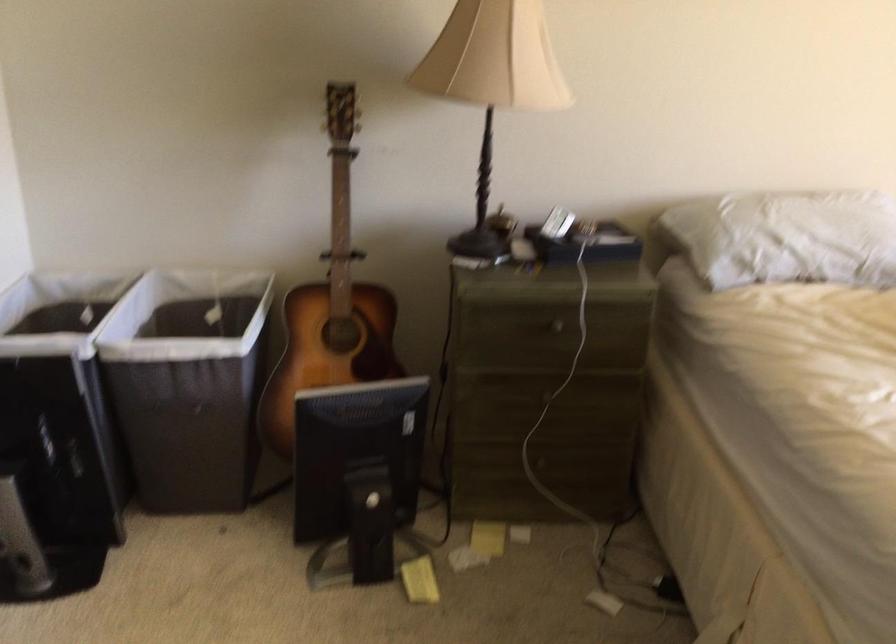
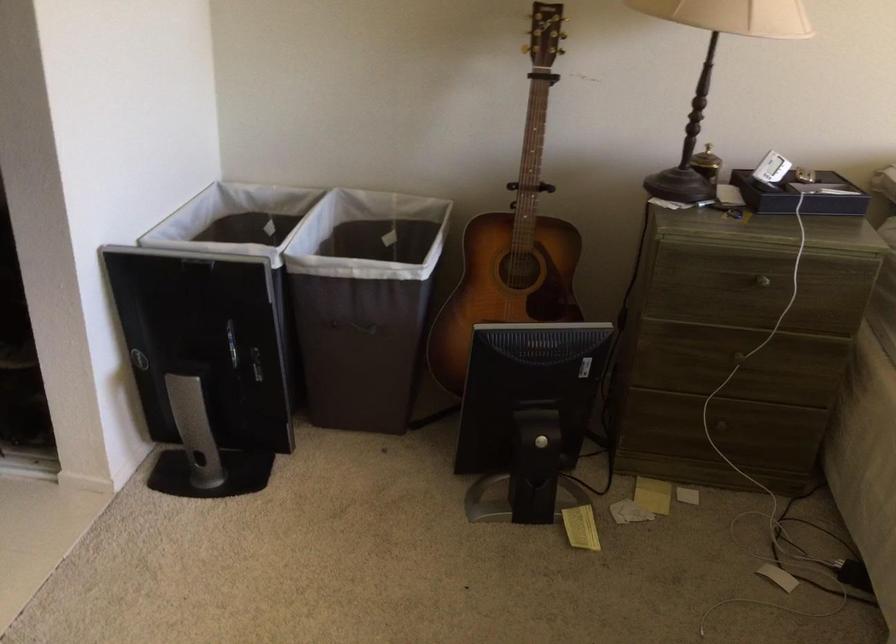
Question: The images are taken continuously from a first-person perspective. In which direction is your viewpoint rotating?

Choices:
 (A) Left
 (B) Right
 (C) Up
 (D) Down

Answer: (A)